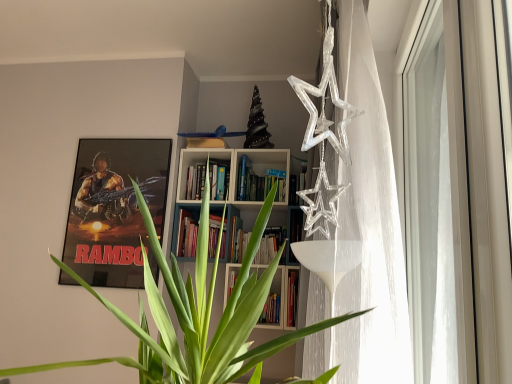
Question: Relative to transparent glass window at right, is metallic poster at upper left in front or behind?

Choices:
 (A) front
 (B) behind

Answer: (B)

Question: From the image's perspective, relative to transparent glass window at right, is metallic poster at upper left above or below?

Choices:
 (A) below
 (B) above

Answer: (A)

Question: Would you say metallic poster at upper left is inside or outside transparent glass window at right?

Choices:
 (A) inside
 (B) outside

Answer: (B)

Question: Based on their positions, is transparent glass window at right located to the left or right of metallic poster at upper left?

Choices:
 (A) left
 (B) right

Answer: (B)

Question: In terms of height, does transparent glass window at right look taller or shorter compared to metallic poster at upper left?

Choices:
 (A) short
 (B) tall

Answer: (B)

Question: Relative to metallic poster at upper left, is transparent glass window at right in front or behind?

Choices:
 (A) behind
 (B) front

Answer: (B)

Question: Does point (404, 157) appear closer or farther from the camera than point (98, 140)?

Choices:
 (A) closer
 (B) farther

Answer: (A)